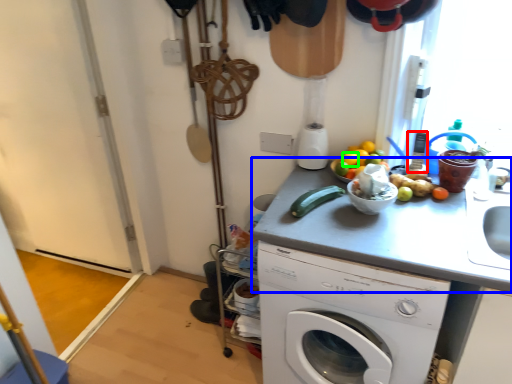
Question: Based on their relative distances, which object is farther from appliance (highlighted by a red box)? Choose from counter top (highlighted by a blue box) and orange (highlighted by a green box).

Choices:
 (A) counter top
 (B) orange

Answer: (A)